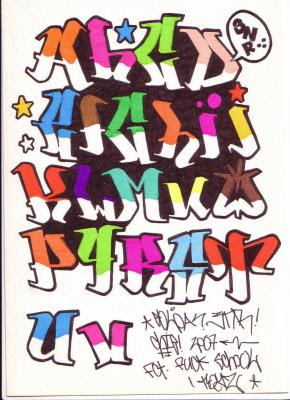
Locate an element on the screen. This screenshot has width=290, height=400. poster is located at coordinates (149, 75).